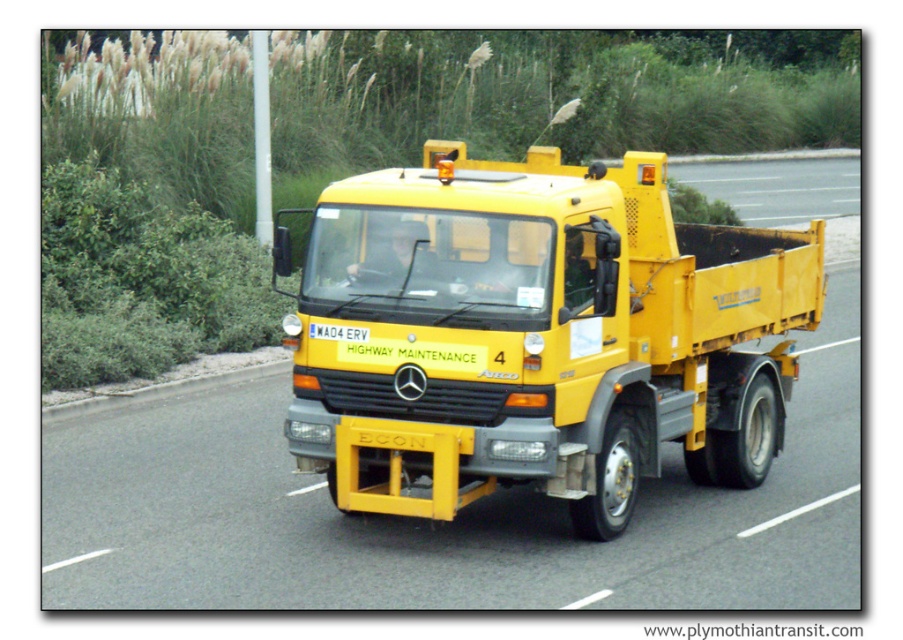
You are standing at the position of the highway maintenance truck and want to determine which of the two points, point [348,460] or point [830,198], is closer to you. Based on the image, which point is nearer?

Point [348,460] is closer to the viewer than point [830,198].

You are a pedestrian standing on the sidewalk next to the yellow asphalt road at center. You see the yellow matte truck at center approaching you. Which direction should you move to stay safe?

The yellow matte truck at center is in front of the yellow asphalt road at center, so you should move to the side opposite the direction the truck is moving to stay safe.

You are a traffic officer observing the road from above. You notice the yellow matte truck at center and the yellow asphalt road at center. Which one takes up more area in the image?

The yellow asphalt road at center takes up more area than the yellow matte truck at center because the truck occupies less space than the road.